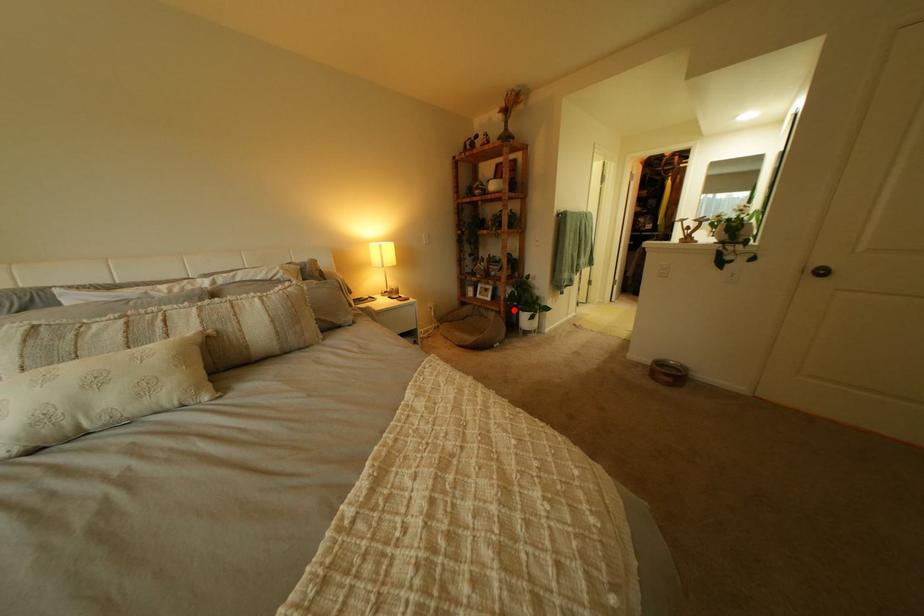
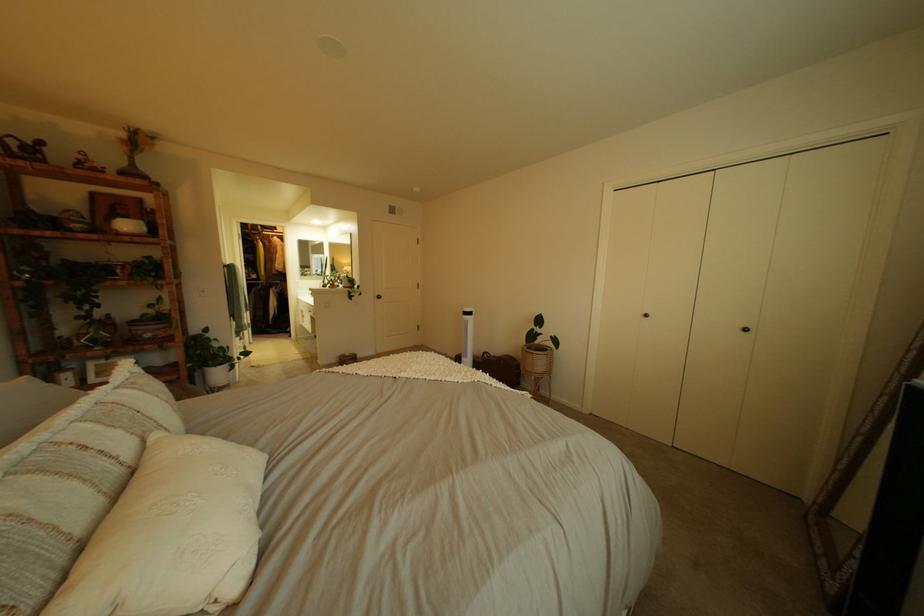
Question: I am providing you with two images of the same scene from different viewpoints. Given a red point in image1, look at the same physical point in image2. Is it:

Choices:
 (A) Closer to the viewpoint
 (B) Farther from the viewpoint

Answer: (A)